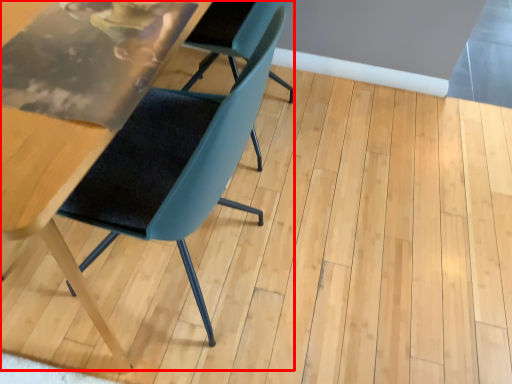
Question: From the image's perspective, what is the correct spatial relationship of chair (annotated by the red box) in relation to chair?

Choices:
 (A) above
 (B) below

Answer: (B)